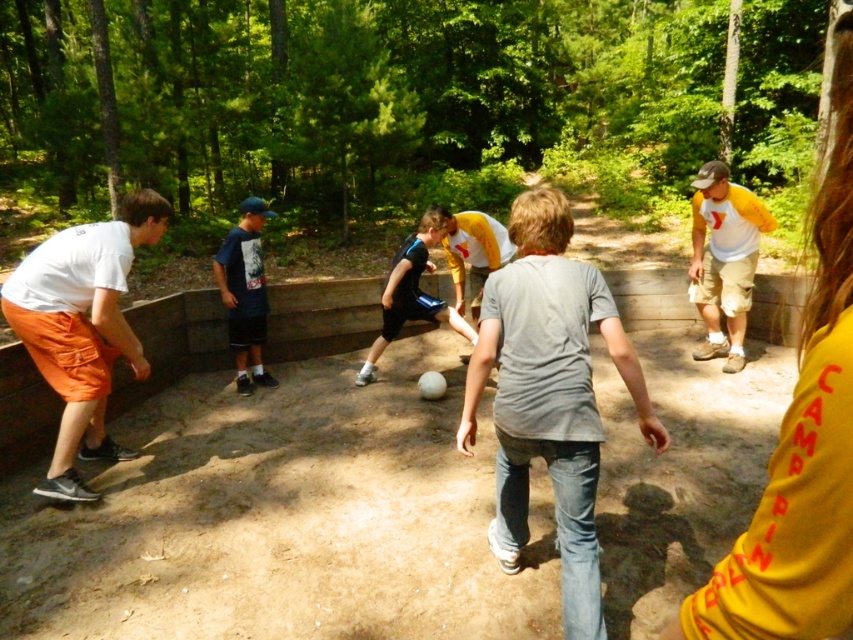
Based on the coordinates provided, which object is located at point (724, 259) in the image?

The point (724, 259) marks the location of the yellow shirt with red text at right.